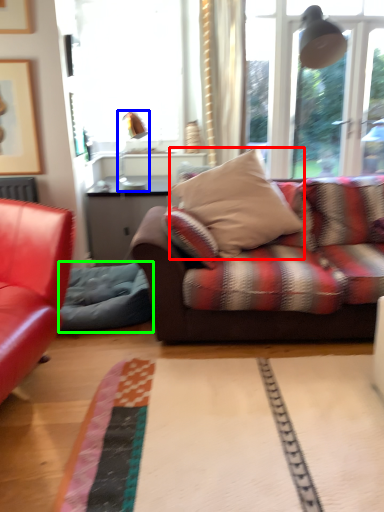
Question: Which is nearer to the pillow (highlighted by a red box)? lamp (highlighted by a blue box) or swivel chair (highlighted by a green box).

Choices:
 (A) lamp
 (B) swivel chair

Answer: (B)